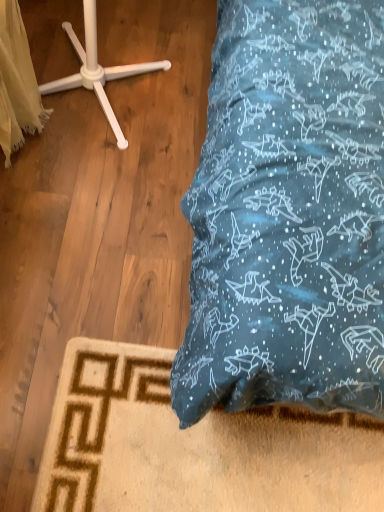
Identify the location of blank area beneath white plastic coat stand at upper left (from a real-world perspective). (109, 84).